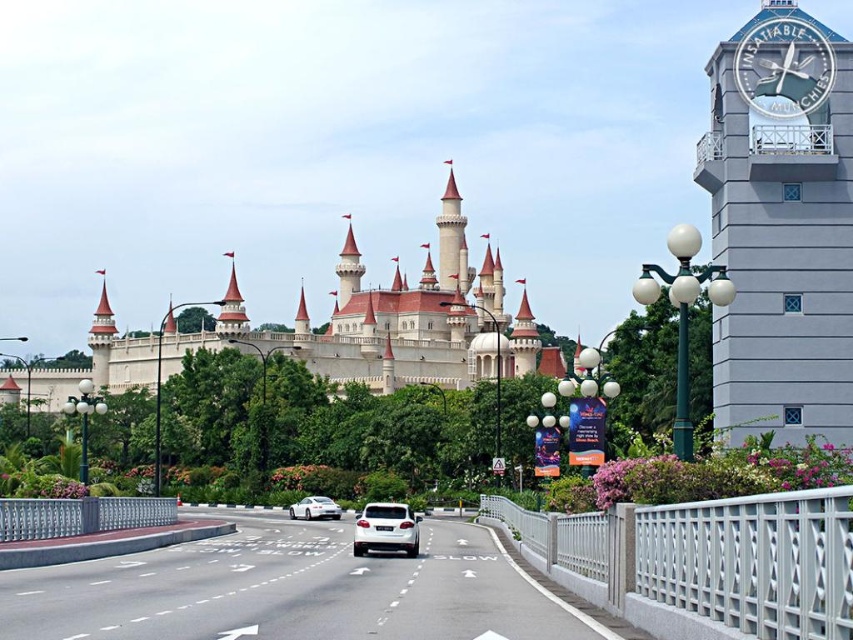
You are driving a white glossy car at center on a white asphalt highway at center. The road has a speed limit of 60 km per hour. Can you safely drive at the maximum speed limit without crossing the lanes?

The white asphalt highway at center is wider than the white glossy car at center, so yes, you can safely drive at the maximum speed limit of 60 km per hour without crossing the lanes.

You are driving a white matte car at center and want to park it near the white stone castle at center. Since both are at the center, how can you determine which direction to drive to get closer to the castle?

The white stone castle at center is further to the viewer than the white matte car at center, so you should drive forward to get closer to the castle.

You are standing at the center of the road in the image. Looking towards the gray concrete clock tower at upper right, in which direction should you turn to face it?

The gray concrete clock tower at upper right is located at point (781, 225), so you should turn to your upper right direction to face it.